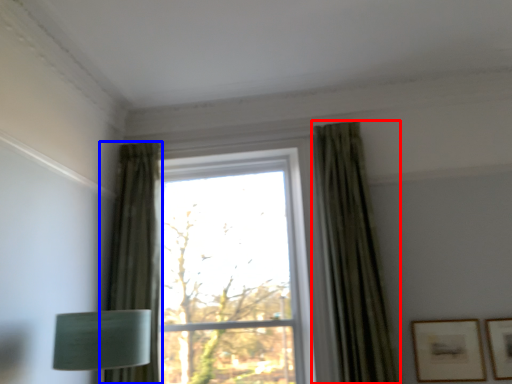
Question: Among these objects, which one is farthest to the camera, curtain (highlighted by a red box) or curtain (highlighted by a blue box)?

Choices:
 (A) curtain
 (B) curtain

Answer: (B)